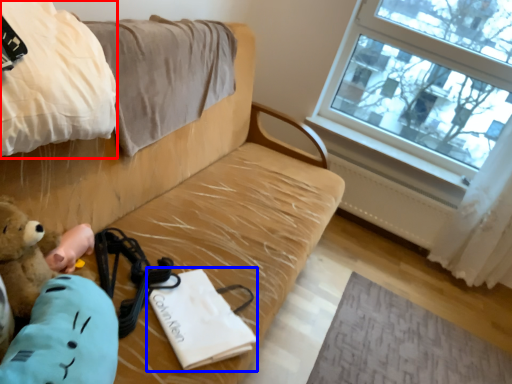
Question: Which of the following is the closest to the observer, blanket (highlighted by a red box) or journal (highlighted by a blue box)?

Choices:
 (A) blanket
 (B) journal

Answer: (A)